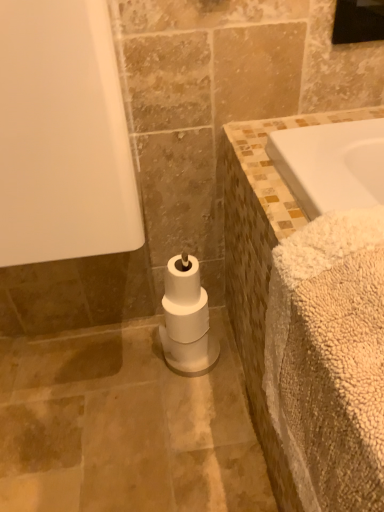
Question: From the image's perspective, is black glass mirror at upper right positioned above or below beige fluffy bath towel at right?

Choices:
 (A) above
 (B) below

Answer: (A)

Question: Considering the positions of point (372, 11) and point (347, 238), is point (372, 11) closer or farther from the camera than point (347, 238)?

Choices:
 (A) closer
 (B) farther

Answer: (B)

Question: Based on their relative distances, which object is nearer to the black glass mirror at upper right?

Choices:
 (A) white matte toilet paper at center
 (B) beige fluffy bath towel at right

Answer: (B)

Question: Estimate the real-world distances between objects in this image. Which object is closer to the beige fluffy bath towel at right?

Choices:
 (A) black glass mirror at upper right
 (B) white matte toilet paper at center

Answer: (B)